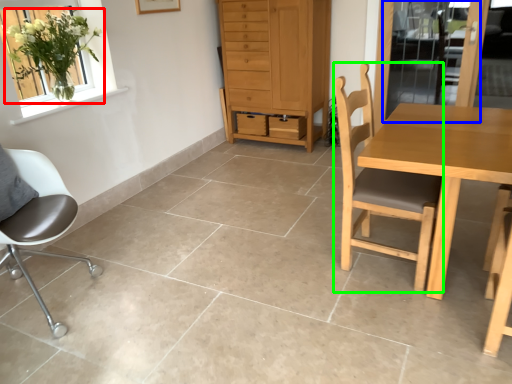
Question: Which is farther away from houseplant (highlighted by a red box)? screen door (highlighted by a blue box) or chair (highlighted by a green box)?

Choices:
 (A) screen door
 (B) chair

Answer: (A)